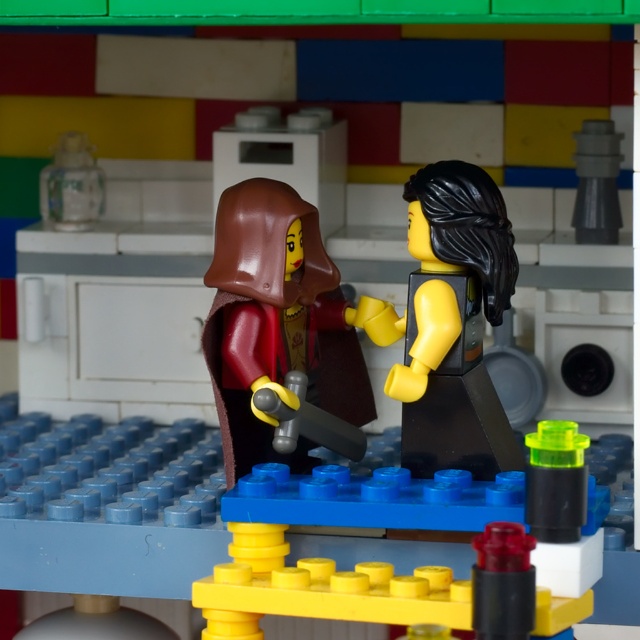
Question: Which object is farther from the camera taking this photo?

Choices:
 (A) smooth brown cape at center
 (B) smooth black minifigure at center

Answer: (B)

Question: Can you confirm if smooth brown cape at center is smaller than smooth black minifigure at center?

Choices:
 (A) yes
 (B) no

Answer: (B)

Question: Can you confirm if smooth brown cape at center is positioned above smooth black minifigure at center?

Choices:
 (A) yes
 (B) no

Answer: (B)

Question: Which point is farther from the camera taking this photo?

Choices:
 (A) (492, 209)
 (B) (304, 221)

Answer: (B)

Question: Observing the image, what is the correct spatial positioning of smooth brown cape at center in reference to smooth black minifigure at center?

Choices:
 (A) left
 (B) right

Answer: (A)